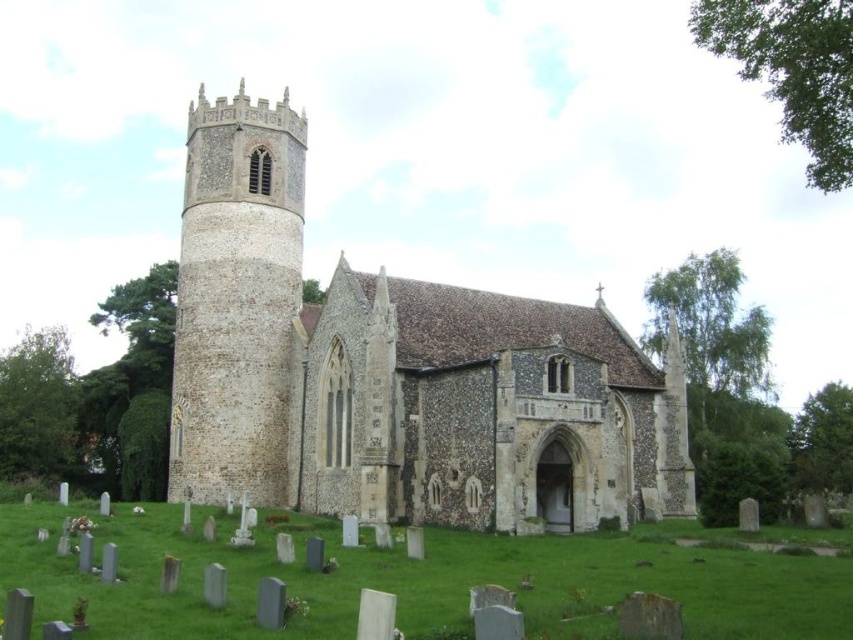
Question: Considering the relative positions of stone church at center and stone tower at left in the image provided, where is stone church at center located with respect to stone tower at left?

Choices:
 (A) right
 (B) left

Answer: (A)

Question: Which point appears farthest from the camera in this image?

Choices:
 (A) (259, 257)
 (B) (195, 476)

Answer: (A)

Question: In this image, where is stone church at center located relative to stone tower at left?

Choices:
 (A) right
 (B) left

Answer: (A)

Question: Is stone church at center above stone tower at left?

Choices:
 (A) yes
 (B) no

Answer: (B)

Question: Which point is closer to the camera taking this photo?

Choices:
 (A) 267,244
 (B) 407,422

Answer: (B)